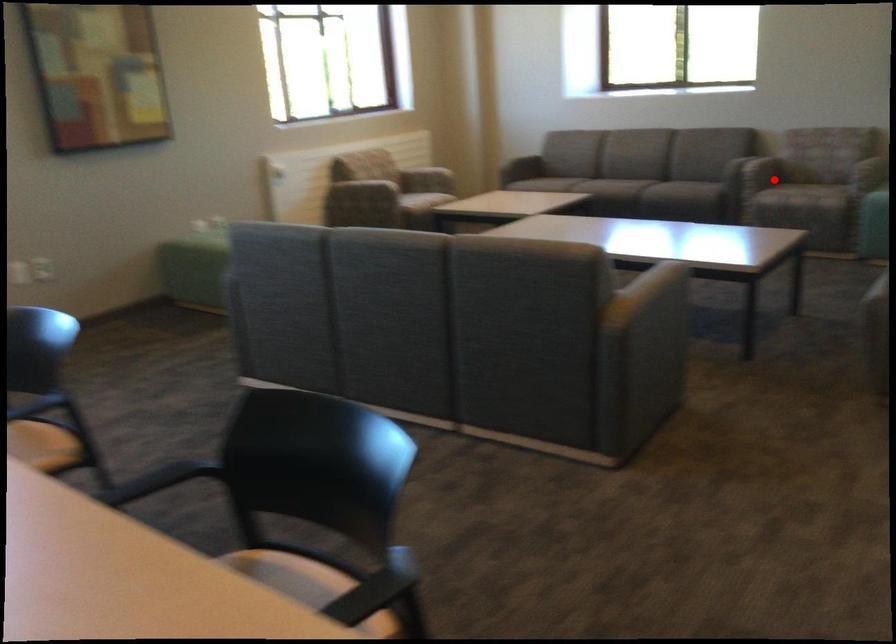
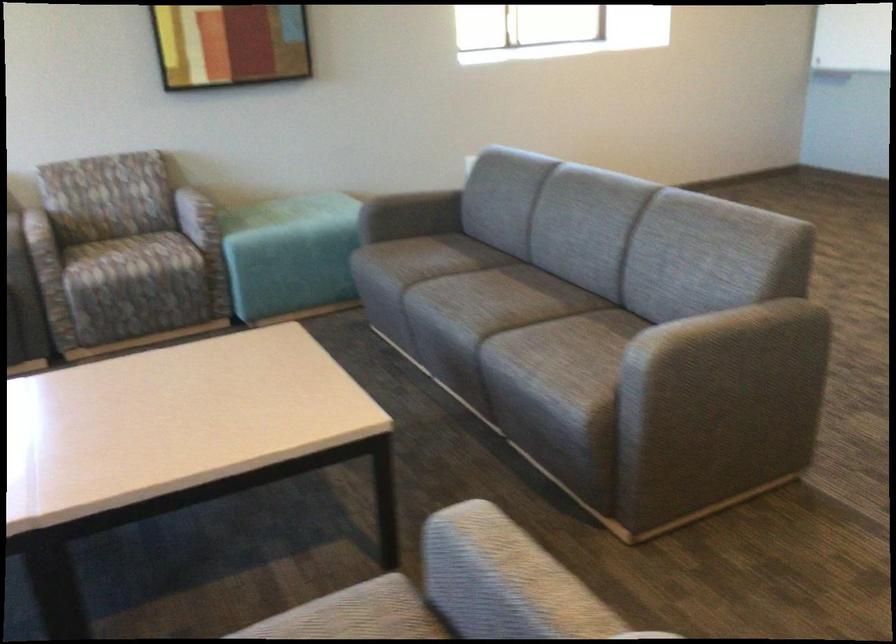
Find the pixel in the second image that matches the highlighted location in the first image.

(125, 259)